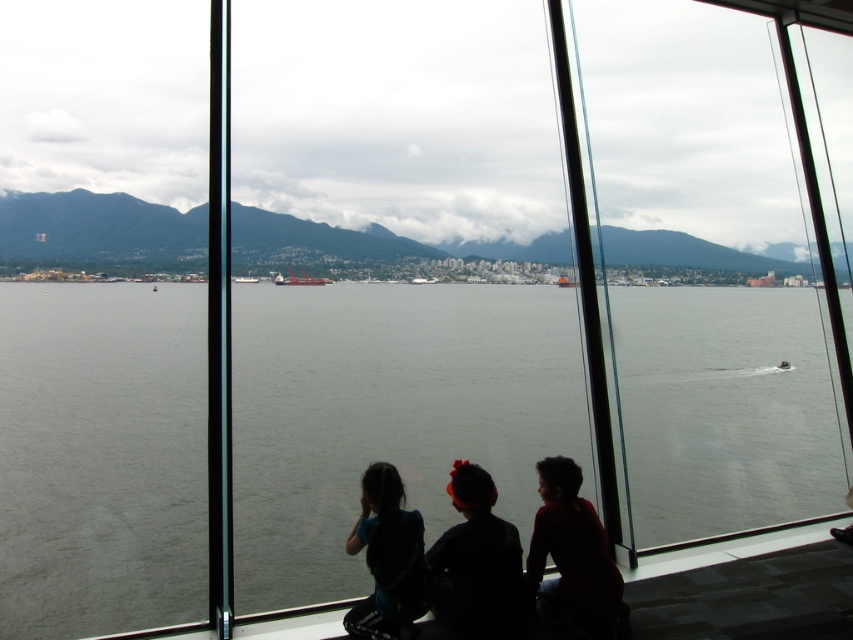
You are standing inside the building looking through the large glass windows. You notice two points marked on the window at coordinates point [608,602] and point [570,284]. Which point is closer to you?

Point [608,602] is in front of point [570,284], so the point closer to you is point [608,602].

You are a photographer trying to capture a photo of the orange matte ship at center without the silhouette of child at right blocking it. Based on their relative sizes in the image, can you tell if the ship will be visible behind the child?

The silhouette of child at right is much taller than the orange matte ship at center, so the child may block the ship in the photo.

You are a photographer trying to capture a shot of the white plastic boat at center while also including the silhouette of child at right in the frame. Given their positions, will you need to adjust your camera angle to include both in the same photo?

The silhouette of child at right is closer to the viewer than the white plastic boat at center, so you will need to adjust your camera angle to include both in the same photo.